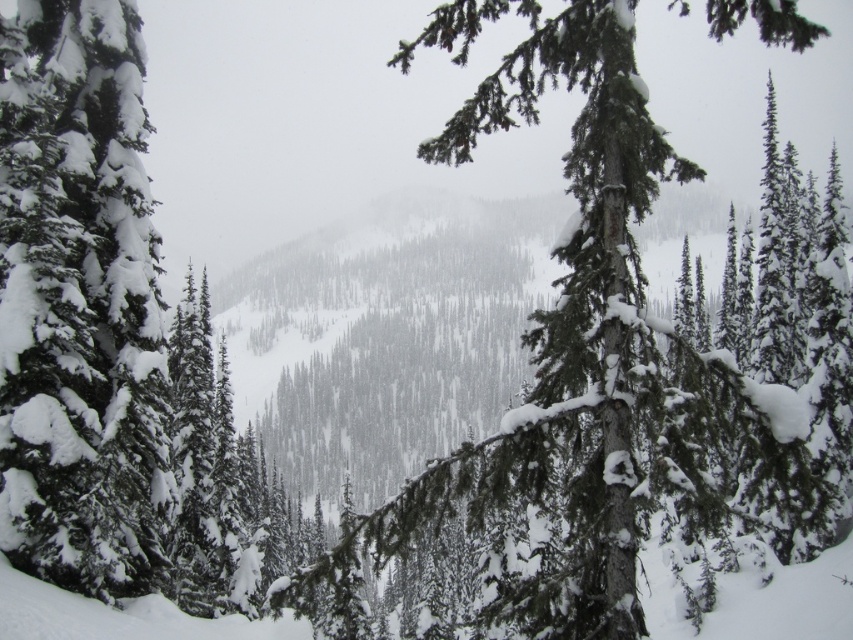
Is point (527, 456) farther from camera compared to point (32, 298)?

That is False.

Identify the location of green textured pine tree at center. (577, 346).